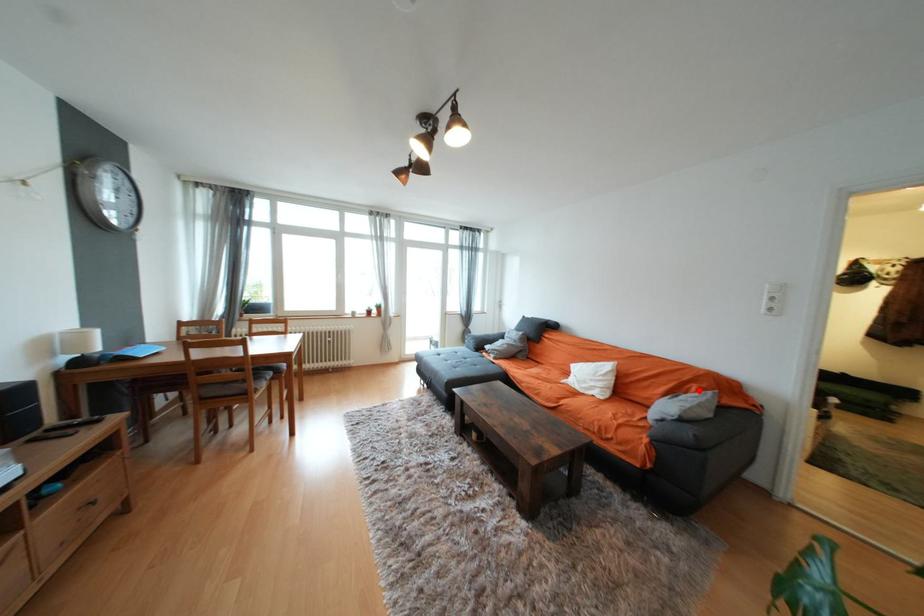
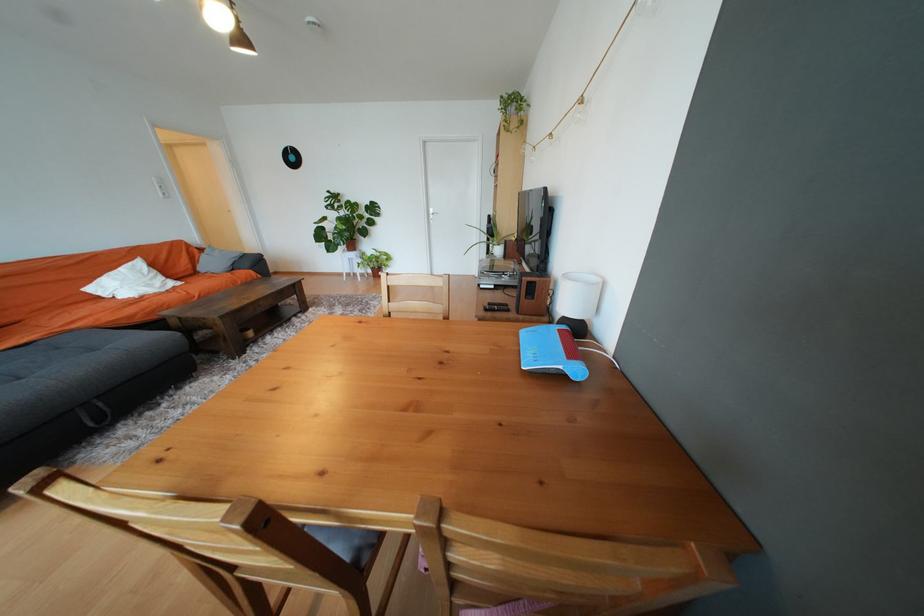
Question: I am providing you with two images of the same scene from different viewpoints. A red point is shown in image1. For the corresponding object point in image2, is it positioned nearer or farther from the camera?

Choices:
 (A) Nearer
 (B) Farther

Answer: (A)